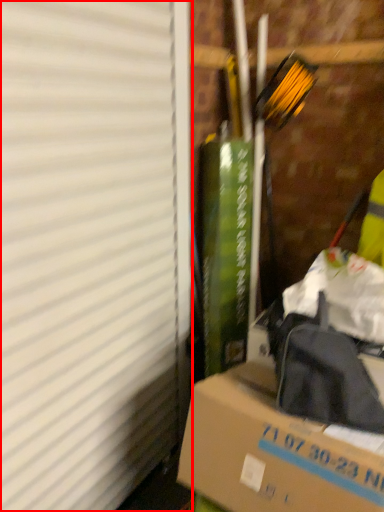
Question: From the image's perspective, where is window screen (annotated by the red box) located relative to box?

Choices:
 (A) below
 (B) above

Answer: (B)